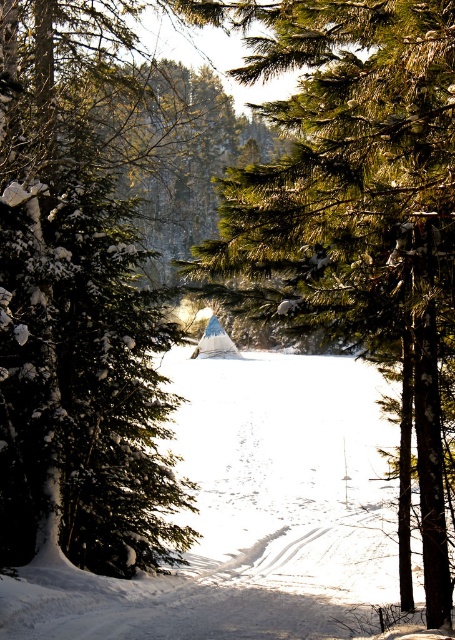
Between green matte evergreen tree at left and green textured pine tree at center, which one appears on the left side from the viewer's perspective?

From the viewer's perspective, green matte evergreen tree at left appears more on the left side.

Is point (64, 461) less distant than point (370, 211)?

No.

Identify the location of green matte evergreen tree at left. Image resolution: width=455 pixels, height=640 pixels. (75, 308).

Which is more to the right, green textured pine tree at center or white powdery snow at center?

green textured pine tree at center is more to the right.

Does green textured pine tree at center have a greater height compared to white powdery snow at center?

Yes.

Does point (397, 200) come closer to viewer compared to point (398, 595)?

Yes, it is in front of point (398, 595).

Where is `green textured pine tree at center`? green textured pine tree at center is located at coordinates (355, 198).

Looking at this image, does green matte evergreen tree at left appear under white powdery snow at center?

Incorrect, green matte evergreen tree at left is not positioned below white powdery snow at center.

Can you confirm if green matte evergreen tree at left is positioned above white powdery snow at center?

Indeed, green matte evergreen tree at left is positioned over white powdery snow at center.

Does point (156, 298) lie in front of point (302, 632)?

No, (156, 298) is further to viewer.

Find the location of a particular element. This screenshot has height=640, width=455. green matte evergreen tree at left is located at coordinates (75, 308).